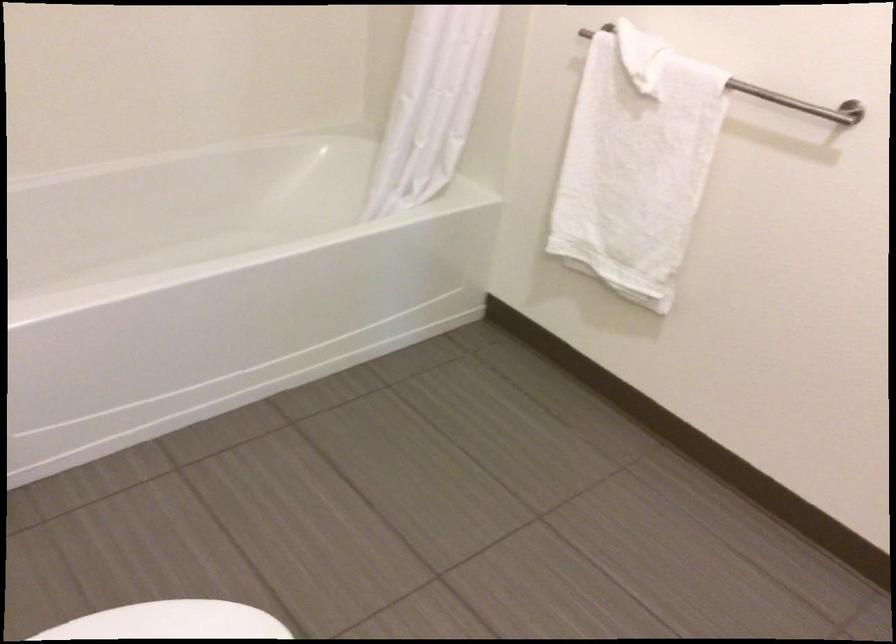
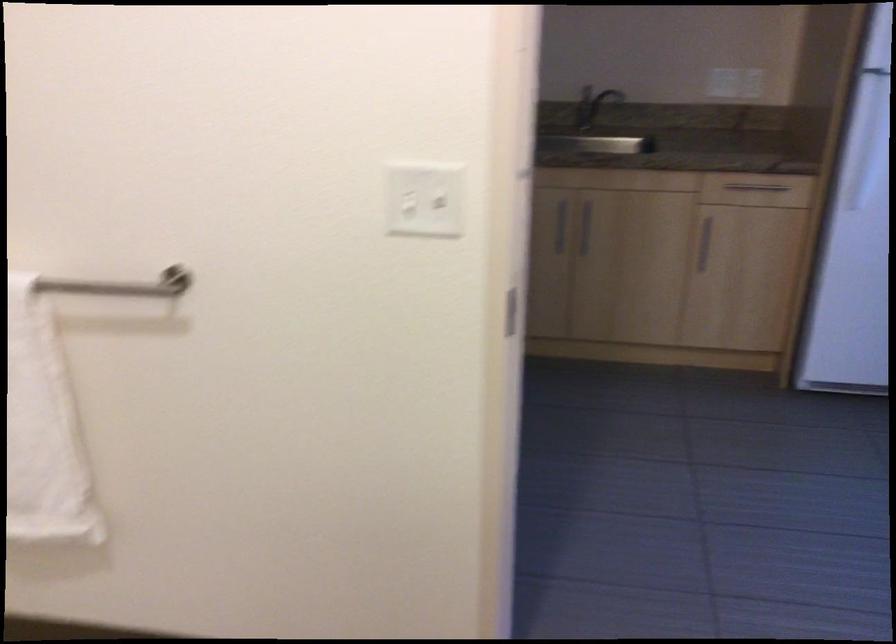
Question: Based on the continuous images, in which direction is the camera rotating? Reply with the corresponding letter.

Choices:
 (A) Left
 (B) Right
 (C) Up
 (D) Down

Answer: (B)